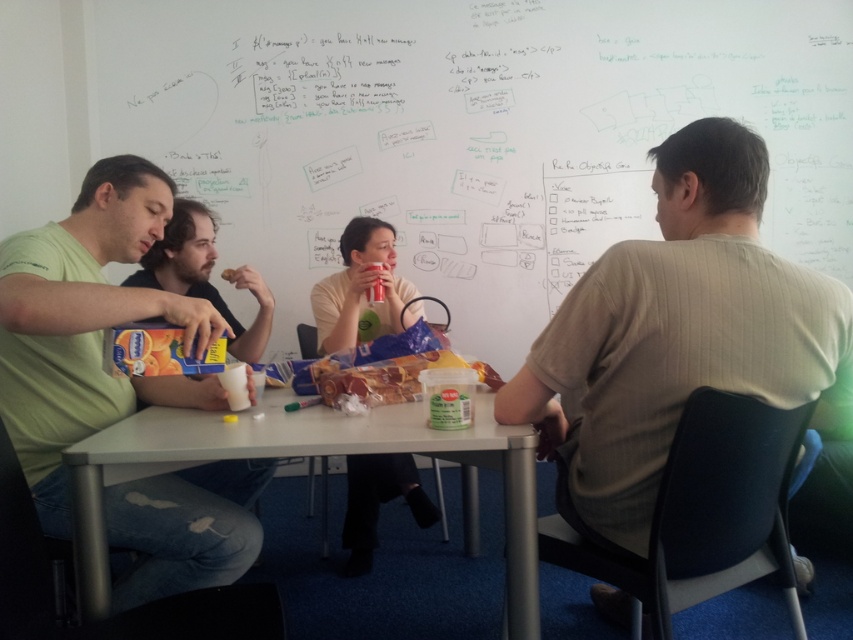
Does light beige cotton shirt at upper right have a lesser width compared to metallic silver table at center?

No.

Does light beige cotton shirt at upper right appear over metallic silver table at center?

Correct, light beige cotton shirt at upper right is located above metallic silver table at center.

What do you see at coordinates (677, 333) in the screenshot?
I see `light beige cotton shirt at upper right` at bounding box center [677, 333].

You are a GUI agent. You are given a task and a screenshot of the screen. Output one action in this format:
    pyautogui.click(x=<x>, y=<y>)
    Task: Click on the light beige cotton shirt at upper right
    Image resolution: width=853 pixels, height=640 pixels.
    Given the screenshot: What is the action you would take?
    pyautogui.click(x=677, y=333)

Looking at this image, between whiteboard at upper center and light beige cotton shirt at upper right, which one is positioned lower?

light beige cotton shirt at upper right is below.

What are the coordinates of `whiteboard at upper center` in the screenshot? It's located at (471, 132).

Is point (474, 19) closer to viewer compared to point (560, 356)?

No, it is behind (560, 356).

This screenshot has width=853, height=640. Find the location of `whiteboard at upper center`. whiteboard at upper center is located at coordinates (471, 132).

Can you confirm if metallic silver table at center is positioned below matte green t-shirt at left?

Yes.

Who is more forward, (462, 440) or (187, 273)?

Point (462, 440)

Is point (514, 445) more distant than point (204, 481)?

No, (514, 445) is closer to viewer.

The height and width of the screenshot is (640, 853). Find the location of `metallic silver table at center`. metallic silver table at center is located at coordinates [x=310, y=456].